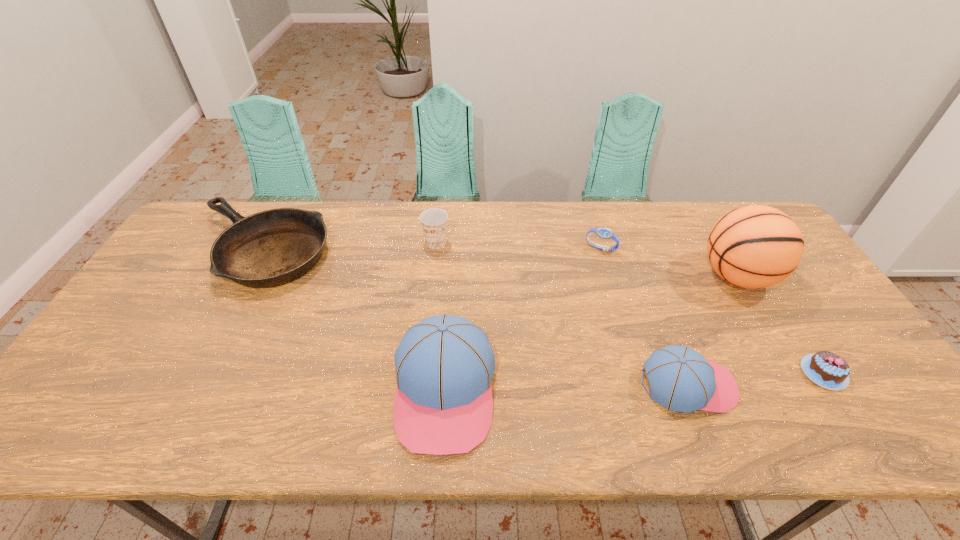
This screenshot has width=960, height=540. I want to click on free space for a new baseball cap on the left, so click(x=198, y=394).